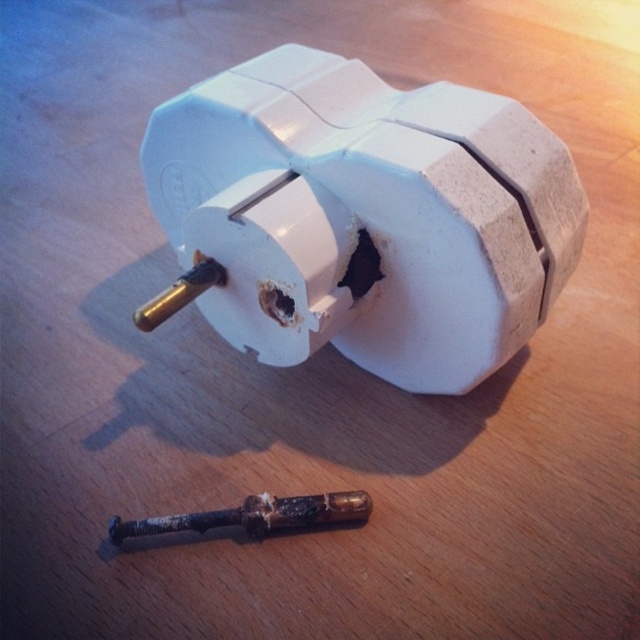
Is white plastic plug at center above rusty metallic screwdriver at lower center?

Yes.

Does white plastic plug at center have a greater width compared to rusty metallic screwdriver at lower center?

Indeed, white plastic plug at center has a greater width compared to rusty metallic screwdriver at lower center.

Does point (400, 188) come behind point (301, 499)?

No, it is in front of (301, 499).

Locate an element on the screen. This screenshot has height=640, width=640. white plastic plug at center is located at coordinates (365, 216).